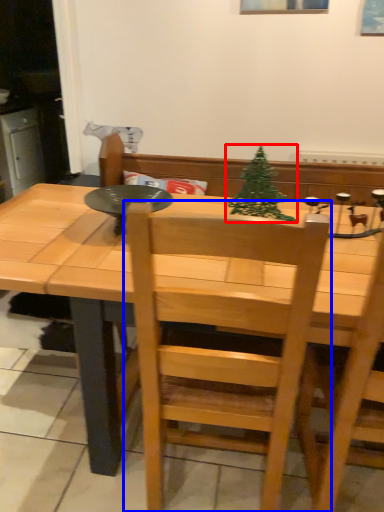
Question: Among these objects, which one is farthest to the camera, christmas tree (highlighted by a red box) or chair (highlighted by a blue box)?

Choices:
 (A) christmas tree
 (B) chair

Answer: (A)